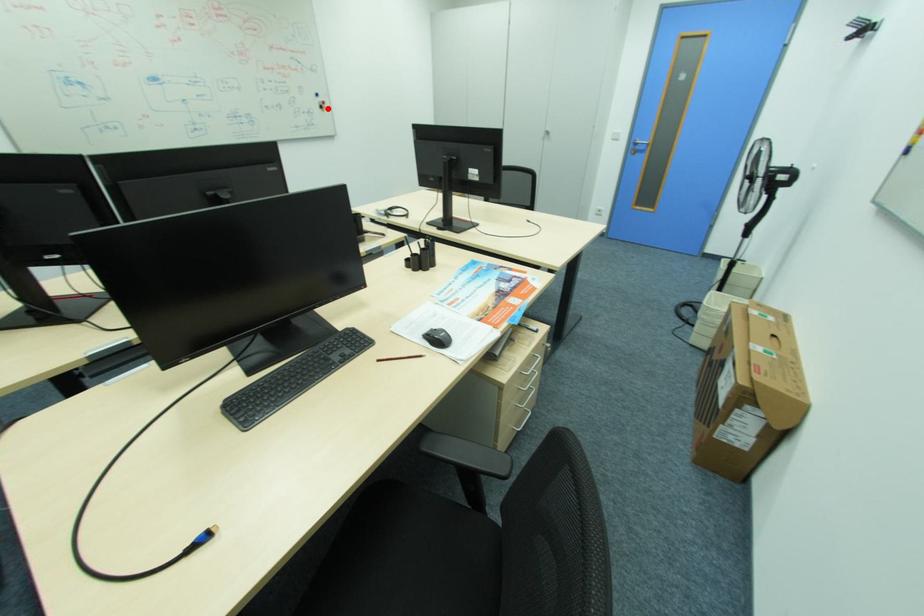
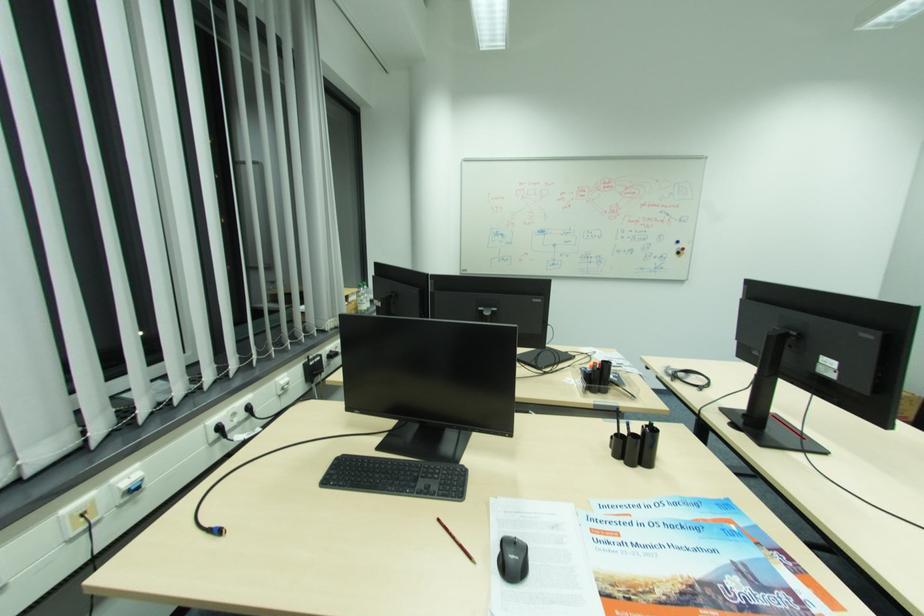
Question: I am providing you with two images of the same scene from different viewpoints. Image1 has a red point marked. In image2, the corresponding 3D location appears at what relative position? Reply with the corresponding letter.

Choices:
 (A) Closer
 (B) Farther

Answer: (B)